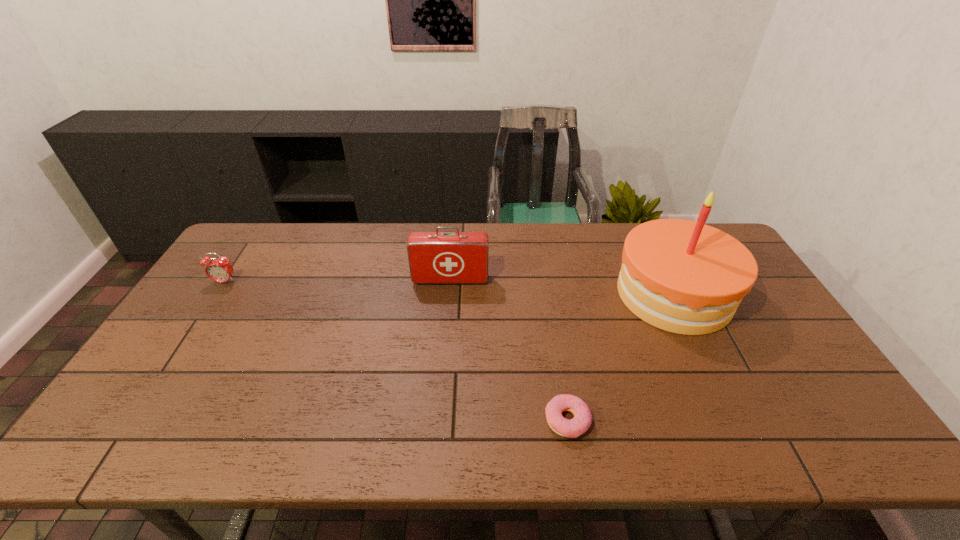
This screenshot has width=960, height=540. Identify the location of vacant space located on the face of the leftmost object. (156, 388).

The image size is (960, 540). Find the location of `free spot located 0.330m on the left of the shortest object`. free spot located 0.330m on the left of the shortest object is located at coordinates (403, 420).

The image size is (960, 540). What are the coordinates of `object at the far edge` in the screenshot? It's located at (685, 277).

What are the coordinates of `object situated at the near edge` in the screenshot? It's located at (582, 420).

This screenshot has height=540, width=960. In order to click on object situated at the left edge in this screenshot , I will do `click(219, 270)`.

Identify the location of object present at the right edge. The height and width of the screenshot is (540, 960). (685, 277).

Identify the location of object that is at the far right corner. The width and height of the screenshot is (960, 540). (x=685, y=277).

Locate an element on the screen. This screenshot has height=540, width=960. vacant space at the far edge of the desktop is located at coordinates (383, 242).

This screenshot has height=540, width=960. Identify the location of vacant area at the near edge. (492, 453).

The image size is (960, 540). In the image, there is a desktop. In order to click on free space at the left edge in this screenshot , I will do `click(167, 415)`.